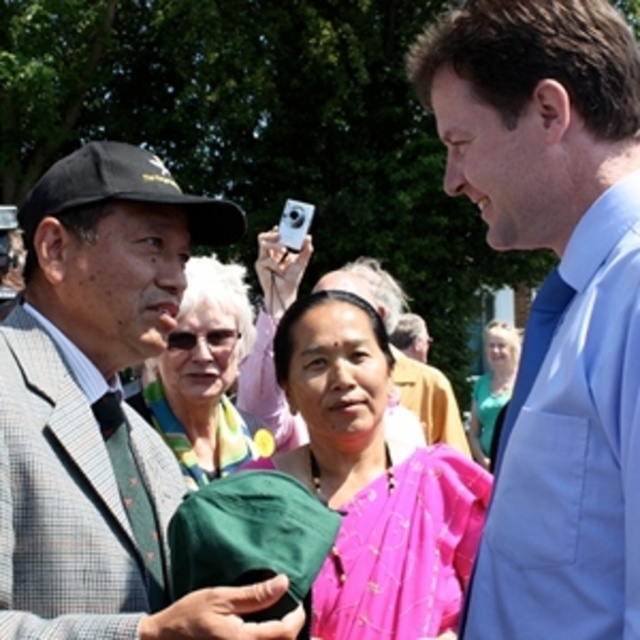
You are standing in the park and want to take a photo of the point at coordinates (x=488, y=483). The camera you are using has a minimum focus distance of 5 meters. Will the camera be able to focus on the point?

The point at coordinates (x=488, y=483) is 5.62 meters from the camera, which is beyond the minimum focus distance of 5 meters. Therefore, the camera should be able to focus on the point.

You are a photographer trying to capture a group photo of the green fabric cap at left and the pink silk saree at center. Based on their positions, which one should you position closer to the left side of the camera frame to ensure both are fully visible?

The green fabric cap at left is already positioned to the left of the pink silk saree at center, so you should place the green fabric cap at left closer to the left side of the camera frame to ensure both are fully visible.

You are a photographer trying to capture a clear shot of both the green fabric cap at left and the pink silk saree at center. Based on their positions, which object will appear larger in your photo?

The green fabric cap at left will appear larger in the photo because it is closer to the viewer than the pink silk saree at center.